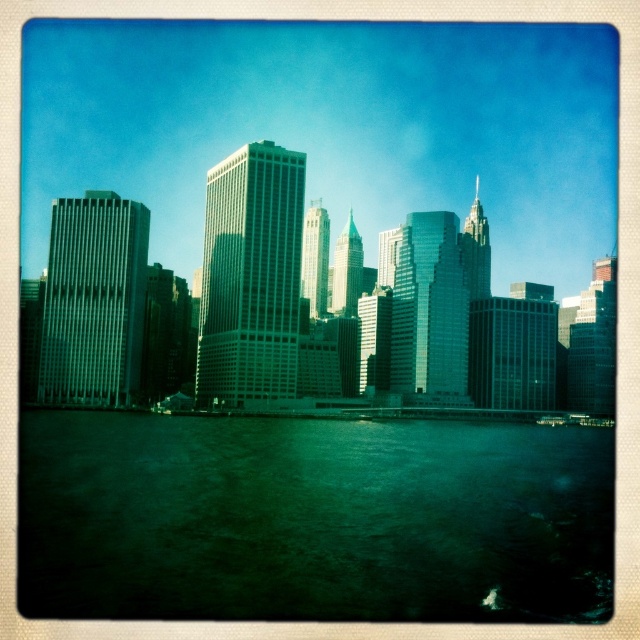
Between point (147, 580) and point (180, 264), which one is positioned in front?

Point (147, 580)

Does green liquid water at lower center appear under glassy skyscrapers at center?

Yes.

Where is `green liquid water at lower center`? The width and height of the screenshot is (640, 640). green liquid water at lower center is located at coordinates (312, 518).